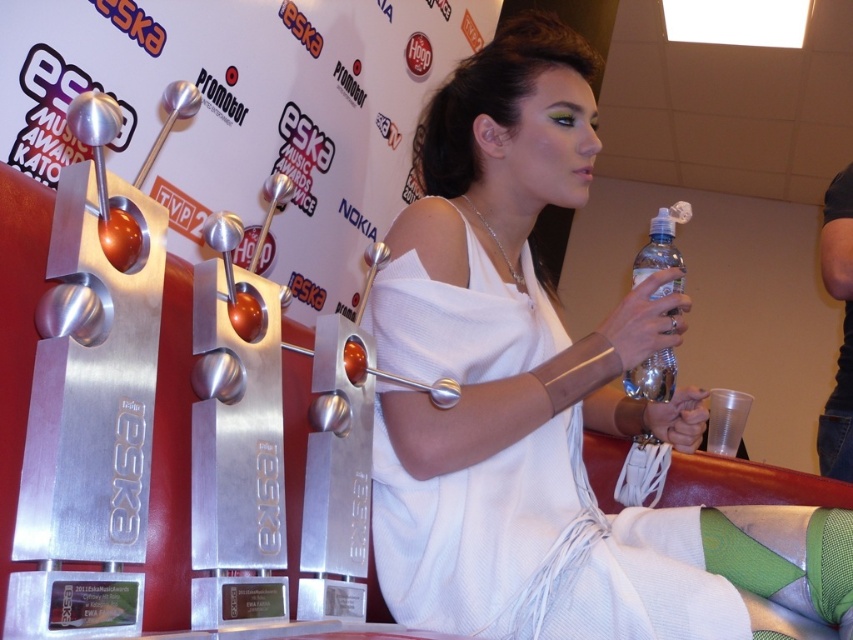
Question: Does white fabric dress at center have a larger size compared to clear plastic bottle at center?

Choices:
 (A) no
 (B) yes

Answer: (B)

Question: Which object is closer to the camera taking this photo?

Choices:
 (A) white fabric dress at center
 (B) clear plastic bottle at center

Answer: (A)

Question: Does white fabric dress at center have a lesser width compared to clear plastic bottle at center?

Choices:
 (A) no
 (B) yes

Answer: (A)

Question: Which of the following is the farthest from the observer?

Choices:
 (A) white fabric dress at center
 (B) clear plastic bottle at center

Answer: (B)

Question: Considering the relative positions of white fabric dress at center and clear plastic bottle at center in the image provided, where is white fabric dress at center located with respect to clear plastic bottle at center?

Choices:
 (A) left
 (B) right

Answer: (A)